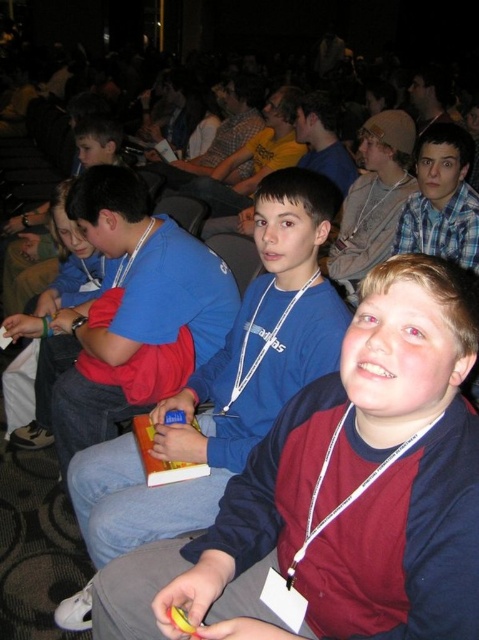
Does point (58, 280) come closer to viewer compared to point (372, 136)?

Yes.

Does blue fabric shirt at left appear under blue denim jeans at center?

Correct, blue fabric shirt at left is located below blue denim jeans at center.

Where is `blue fabric shirt at left`? Image resolution: width=479 pixels, height=640 pixels. blue fabric shirt at left is located at coordinates (47, 332).

Is blue cotton shirt at center further to camera compared to blue denim jeans at center?

No, blue cotton shirt at center is closer to the viewer.

Can you confirm if blue cotton shirt at center is thinner than blue denim jeans at center?

No, blue cotton shirt at center is not thinner than blue denim jeans at center.

Is point (184, 524) farther from camera compared to point (365, 227)?

That is False.

Where is `blue cotton shirt at center`? The width and height of the screenshot is (479, 640). blue cotton shirt at center is located at coordinates (227, 380).

In the scene shown: How far apart are blue cotton shirt at center and blue fabric shirt at left?

The distance of blue cotton shirt at center from blue fabric shirt at left is 36.53 inches.

Who is shorter, blue cotton shirt at center or blue fabric shirt at left?

Standing shorter between the two is blue fabric shirt at left.

At what (x,y) coordinates should I click in order to perform the action: click on blue cotton shirt at center. Please return your answer as a coordinate pair (x, y). Looking at the image, I should click on coord(227,380).

At what (x,y) coordinates should I click in order to perform the action: click on blue cotton shirt at center. Please return your answer as a coordinate pair (x, y). Looking at the image, I should click on (227, 380).